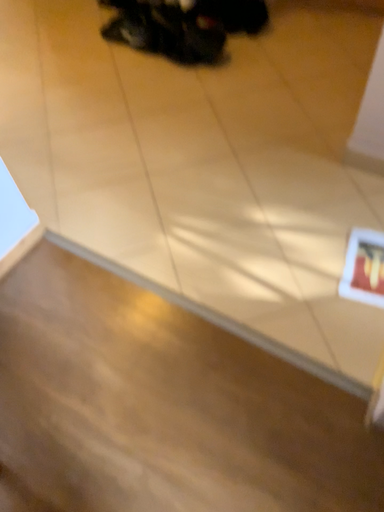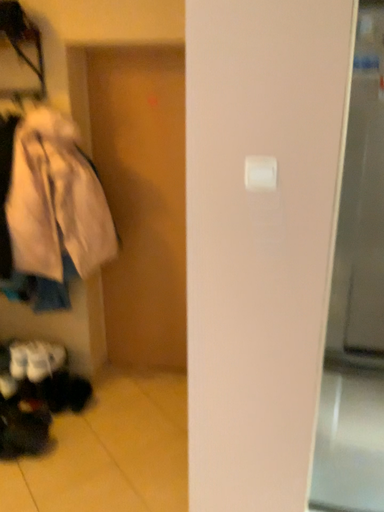
Question: How did the camera likely rotate when shooting the video?

Choices:
 (A) rotated left
 (B) rotated right

Answer: (B)